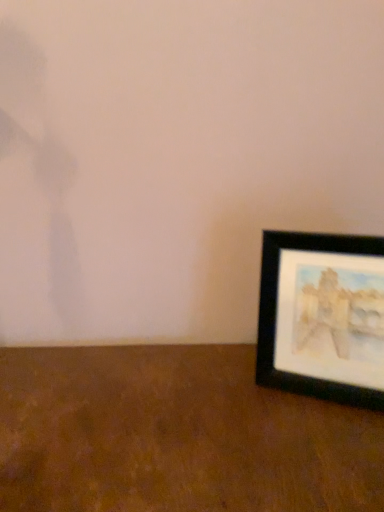
This screenshot has height=512, width=384. What do you see at coordinates (322, 316) in the screenshot? I see `black matte picture frame at lower right` at bounding box center [322, 316].

What is the approximate height of black matte picture frame at lower right?

The height of black matte picture frame at lower right is 10.28 inches.

Find the location of a particular element. Image resolution: width=384 pixels, height=512 pixels. black matte picture frame at lower right is located at coordinates (322, 316).

Locate an element on the screen. black matte picture frame at lower right is located at coordinates (322, 316).